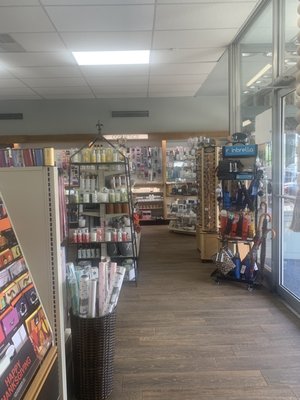
Identify the location of rack. (124, 161).